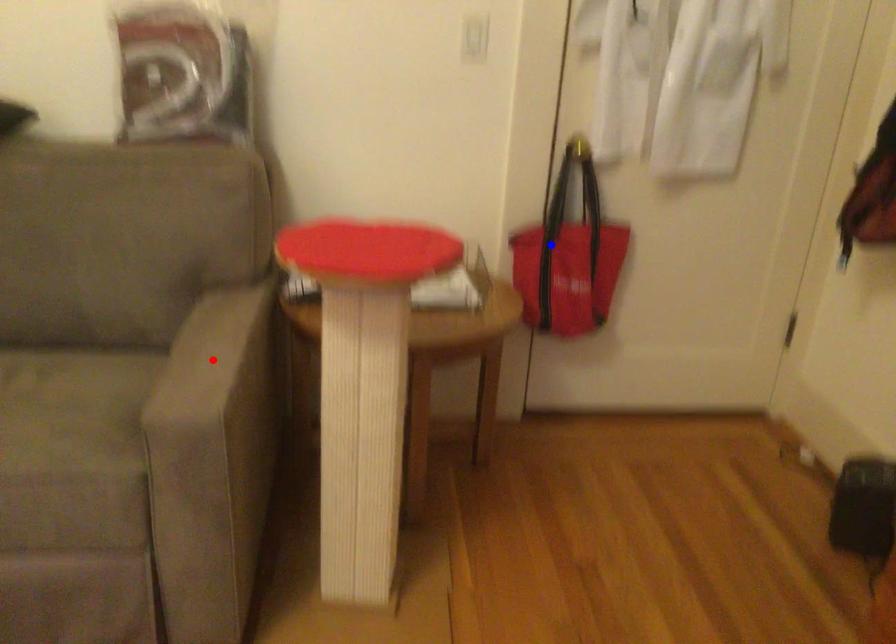
Question: Two points are marked on the image. Which point is closer to the camera?

Choices:
 (A) Blue point is closer.
 (B) Red point is closer.

Answer: (B)